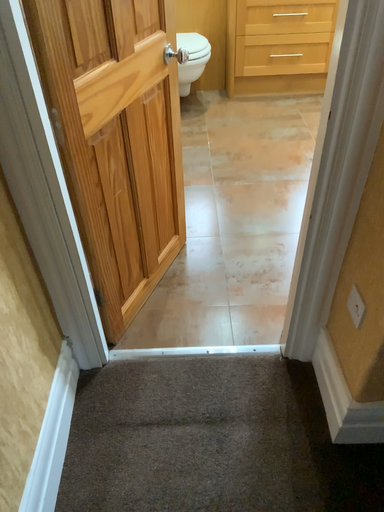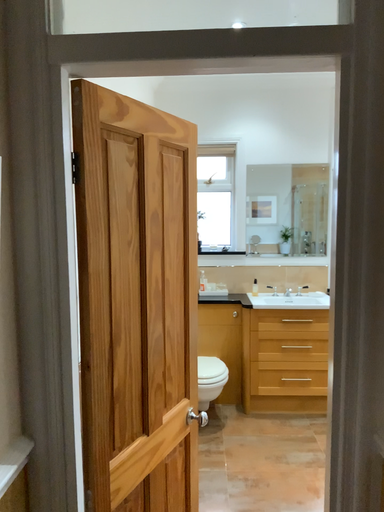
Question: How did the camera likely rotate when shooting the video?

Choices:
 (A) rotated upward
 (B) rotated downward

Answer: (A)